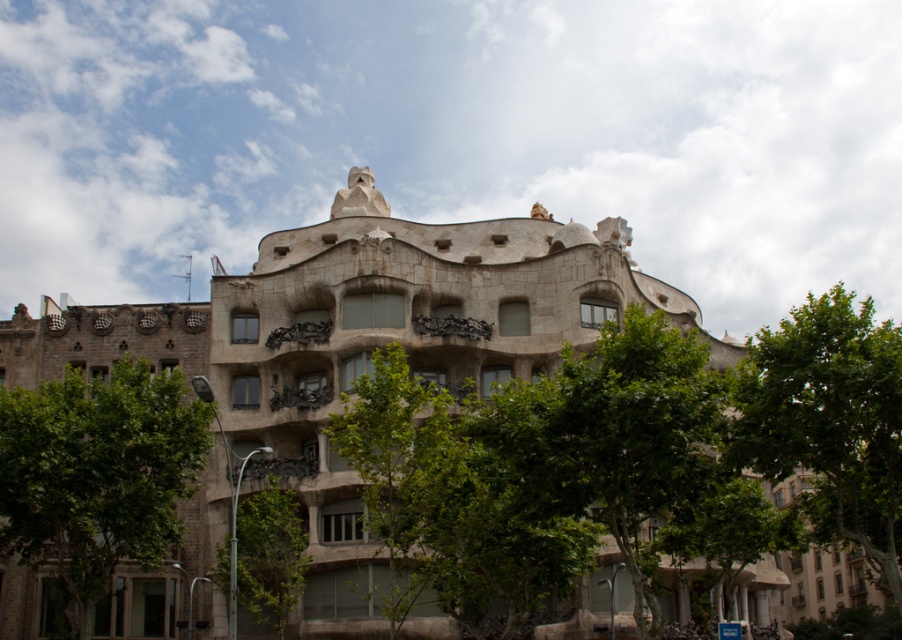
You are standing in front of the building and want to take a photo that includes both the green leafy tree at right and the green leafy tree at lower center. Which tree should you position to your left to ensure both are in the frame?

To include both the green leafy tree at right and the green leafy tree at lower center in your photo, position the green leafy tree at lower center to your left. Since the green leafy tree at right is to the right of the green leafy tree at lower center, placing the lower center tree to your left will naturally place the right tree to its right in the frame, ensuring both are included.

You are a photographer planning to capture the iconic Casa Mila building with both the green leafy tree at lower left and the green leafy tree at right in the frame. Which tree should you position closer to the building to ensure both are visible in the composition?

The green leafy tree at lower left is smaller than the green leafy tree at right. To ensure both are visible, position the smaller green leafy tree at lower left closer to the building since it is smaller and requires less space in the frame.

You are standing in front of the building and want to take a photo that includes both the green leafy tree at center and the green leafy tree at lower center. Which tree should you focus on to ensure both are in the frame without moving your camera position?

The green leafy tree at lower center is narrower than the green leafy tree at center, so focusing on the wider tree at center will help keep both in the frame.